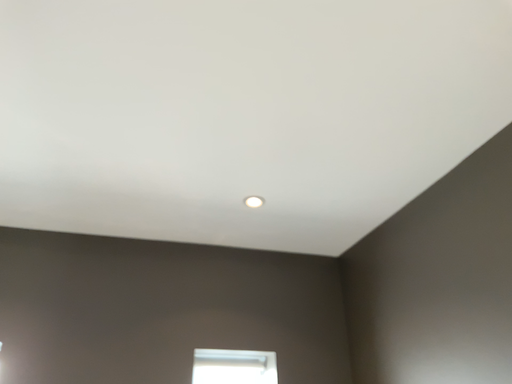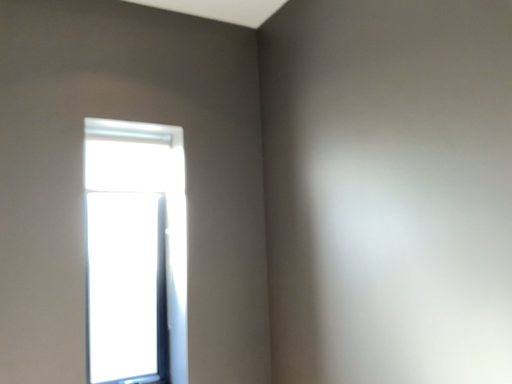
Question: Which way did the camera rotate in the video?

Choices:
 (A) rotated right
 (B) rotated left

Answer: (A)